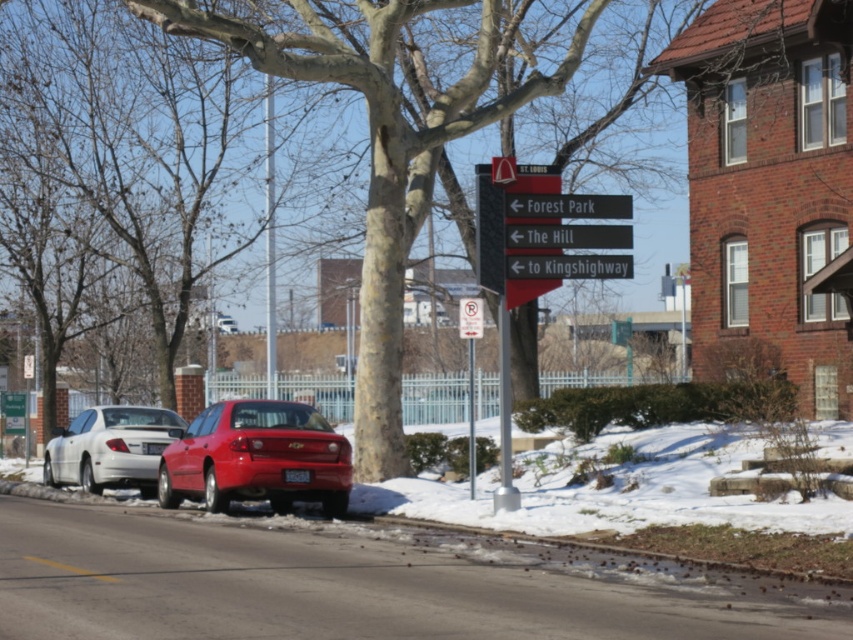
Can you confirm if metallic silver sign at center is positioned to the left of white paper sign at center?

Incorrect, metallic silver sign at center is not on the left side of white paper sign at center.

Can you confirm if metallic silver sign at center is positioned below white paper sign at center?

Actually, metallic silver sign at center is above white paper sign at center.

The height and width of the screenshot is (640, 853). I want to click on metallic silver sign at center, so click(567, 266).

Does black plastic sign at upper center have a lesser width compared to metallic silver sign at center?

Indeed, black plastic sign at upper center has a lesser width compared to metallic silver sign at center.

Which of these two, black plastic sign at upper center or metallic silver sign at center, stands taller?

metallic silver sign at center

Measure the distance between point (619,216) and camera.

Point (619,216) and camera are 21.28 meters apart from each other.

Where is `black plastic sign at upper center`? The image size is (853, 640). black plastic sign at upper center is located at coordinates (567, 205).

Is point (618, 225) positioned before point (474, 328)?

Yes, point (618, 225) is closer to viewer.

Can you confirm if black matte sign at center is positioned below white paper sign at center?

No.

Where is `black matte sign at center`? This screenshot has width=853, height=640. black matte sign at center is located at coordinates (567, 236).

Where is `black matte sign at center`? black matte sign at center is located at coordinates (567, 236).